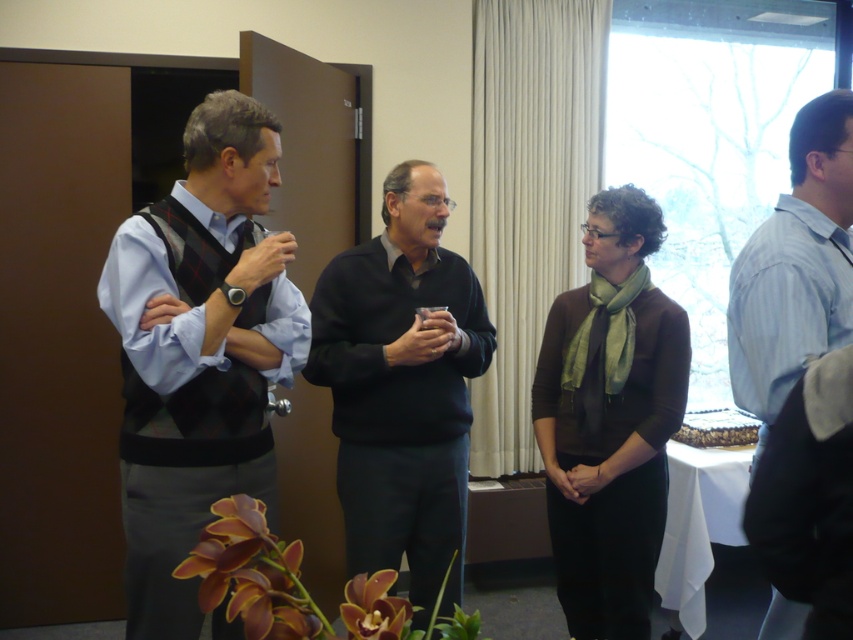
Question: From the image, what is the correct spatial relationship of matte black vest at left in relation to dark gray sweater at center?

Choices:
 (A) below
 (B) above

Answer: (B)

Question: Can you confirm if matte black vest at left is positioned to the left of dark gray sweater at center?

Choices:
 (A) yes
 (B) no

Answer: (A)

Question: Which point is closer to the camera taking this photo?

Choices:
 (A) (843, 173)
 (B) (247, 360)
 (C) (479, 317)

Answer: (A)

Question: Which point is farther from the camera taking this photo?

Choices:
 (A) (811, 129)
 (B) (416, 298)
 (C) (212, 157)

Answer: (B)

Question: Estimate the real-world distances between objects in this image. Which object is farther from the dark gray sweater at center?

Choices:
 (A) light blue shirt at right
 (B) matte black vest at left

Answer: (A)

Question: Is matte black vest at left behind light blue shirt at right?

Choices:
 (A) no
 (B) yes

Answer: (B)